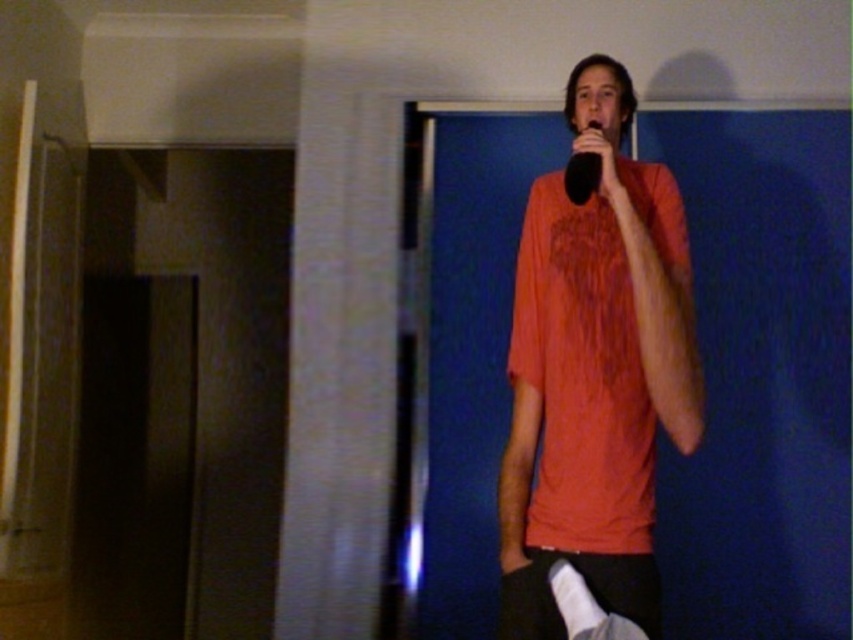
You are a photographer setting up for a portrait. You need to ensure that the orange cotton shirt at center and the black matte microphone at upper center are both visible in the frame. Based on their positions, which object is closer to the camera?

The orange cotton shirt at center is closer to the camera because it is in front of the black matte microphone at upper center.

You are a photographer setting up for a live event. You need to adjust the lighting so that the orange cotton shirt at center and the black matte microphone at upper center are both well illuminated. Considering their sizes, which object should you focus more light on and why?

The orange cotton shirt at center is much taller than the black matte microphone at upper center, so you should focus more light on the orange cotton shirt at center to ensure it is properly illuminated compared to the smaller microphone.

You are a photographer adjusting the lighting in the room. You notice two points marked in the image. The first point is at coordinate point (666, 353) and the second is at point (576, 196). Which point is closer to the person holding the microphone?

Point (666, 353) is in front of point (576, 196), so it is closer to the person holding the microphone.